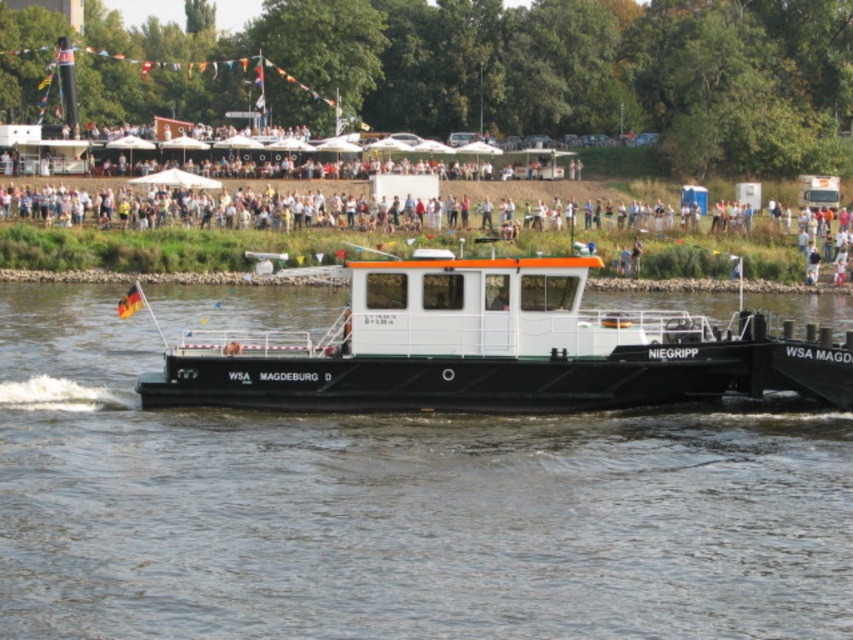
Question: Which of the following is the closest to the observer?

Choices:
 (A) (747, 536)
 (B) (519, 320)

Answer: (A)

Question: Which object is closer to the camera taking this photo?

Choices:
 (A) white matte barge at center
 (B) black matte barge at center

Answer: (B)

Question: Is black matte barge at center thinner than white matte barge at center?

Choices:
 (A) yes
 (B) no

Answer: (B)

Question: Is black matte barge at center above white matte barge at center?

Choices:
 (A) no
 (B) yes

Answer: (A)

Question: Is black matte barge at center further to the viewer compared to white matte barge at center?

Choices:
 (A) yes
 (B) no

Answer: (B)